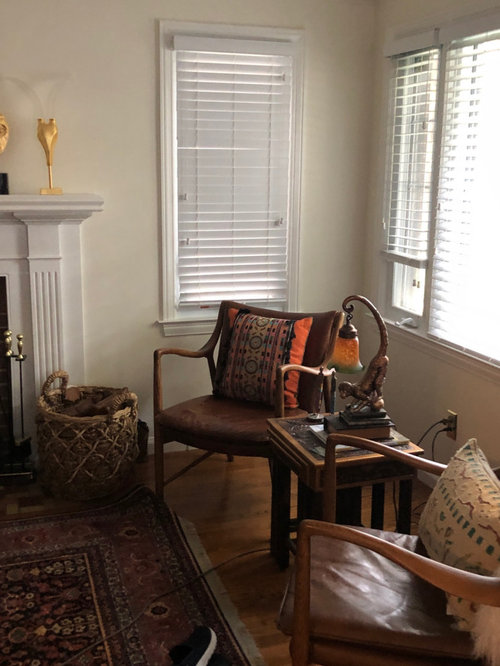
Where is `side table`? The width and height of the screenshot is (500, 666). side table is located at coordinates [316, 475].